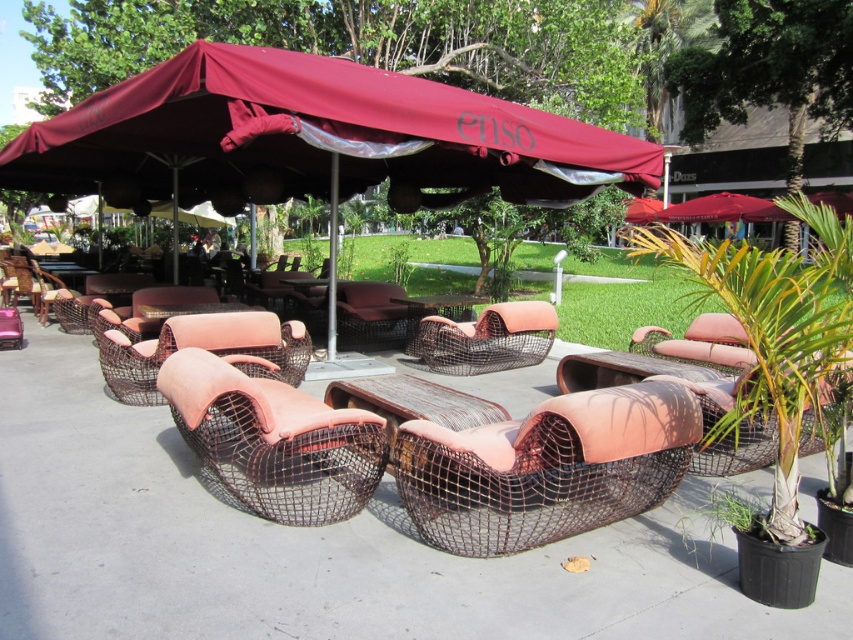
You are designing a layout for a small apartment and need to place both the rustic woven armchair at center and the rustic wicker armchair at center in a narrow hallway. Which chair should you choose to ensure it fits better in the limited space?

The rustic wicker armchair at center has a narrower width compared to the rustic woven armchair at center, so it would fit better in the narrow hallway.

You are sitting in the rustic woven armchair at center and want to place a book on the table between you and the rustic wicker armchair at center. Is the table within reach from your current position?

The rustic woven armchair at center is closer to the viewer than the rustic wicker armchair at center, so the table between them is likely within reach from the rustic woven armchair at center.